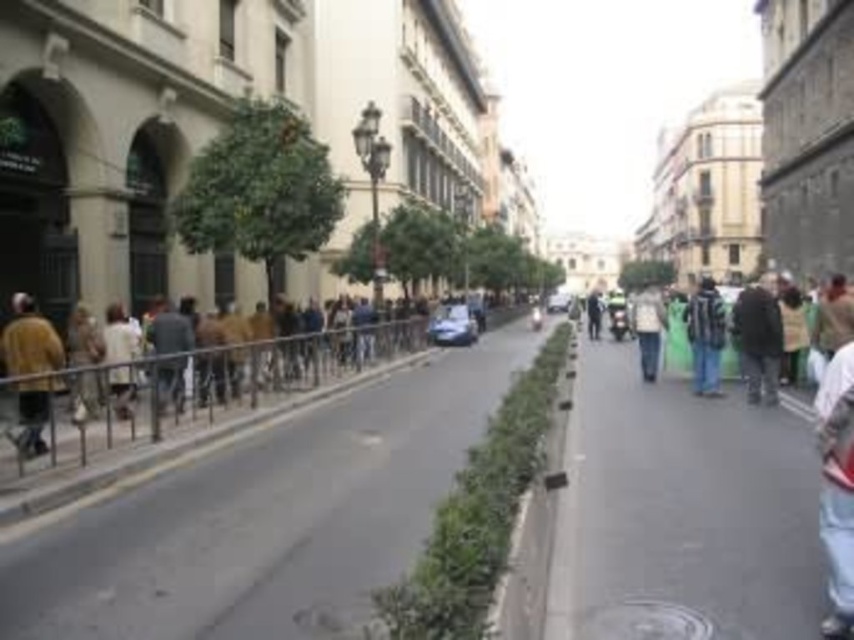
Question: Considering the relative positions of concrete sidewalk at left and smooth asphalt pavement at center in the image provided, where is concrete sidewalk at left located with respect to smooth asphalt pavement at center?

Choices:
 (A) below
 (B) above

Answer: (A)

Question: Which point is closer to the camera taking this photo?

Choices:
 (A) (732, 312)
 (B) (27, 628)

Answer: (B)

Question: Estimate the real-world distances between objects in this image. Which object is farther from the concrete sidewalk at left?

Choices:
 (A) brown leather jacket at left
 (B) dark brown leather jacket at right
 (C) green fabric bag at center

Answer: (C)

Question: Which object appears closest to the camera in this image?

Choices:
 (A) brown leather jacket at left
 (B) green fabric bag at center
 (C) concrete sidewalk at left

Answer: (C)

Question: Observing the image, what is the correct spatial positioning of dark brown leather jacket at right in reference to green fabric bag at center?

Choices:
 (A) above
 (B) below

Answer: (B)

Question: Can you confirm if smooth asphalt pavement at center is wider than dark brown leather jacket at right?

Choices:
 (A) no
 (B) yes

Answer: (A)